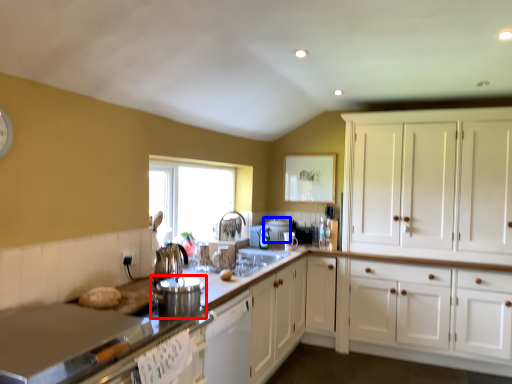
Question: Which object appears farthest to the camera in this image, appliance (highlighted by a red box) or appliance (highlighted by a blue box)?

Choices:
 (A) appliance
 (B) appliance

Answer: (B)